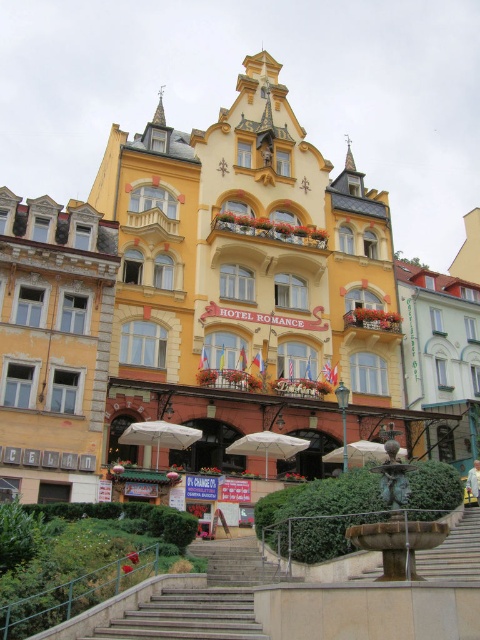
You are a guest at the HOTEL ROMANCE and want to sit under the white matte umbrella at lower center. However, you have a heavy suitcase. Can you easily carry your suitcase up the brown stone stairs at lower center to reach the umbrella?

The brown stone stairs at lower center is positioned under the white matte umbrella at lower center, so the stairs lead directly to the umbrella. However, carrying a heavy suitcase up the stairs may be challenging due to the stairs being made of stone and possibly having steps that are steep or narrow. It is recommended to check the stairs for handrails or ask for assistance to ensure safe passage.

You are standing in front of the HOTEL ROMANCE and want to take a photo of the building. You notice the brown stone stairs at lower center and the white matte umbrella at center. Which object should you focus on first to ensure both are in the frame without moving the camera?

You should focus on the brown stone stairs at lower center first since it is closer to the viewer than the white matte umbrella at center. By focusing on the closer object, both will be in focus as the depth of field will likely include the farther object.